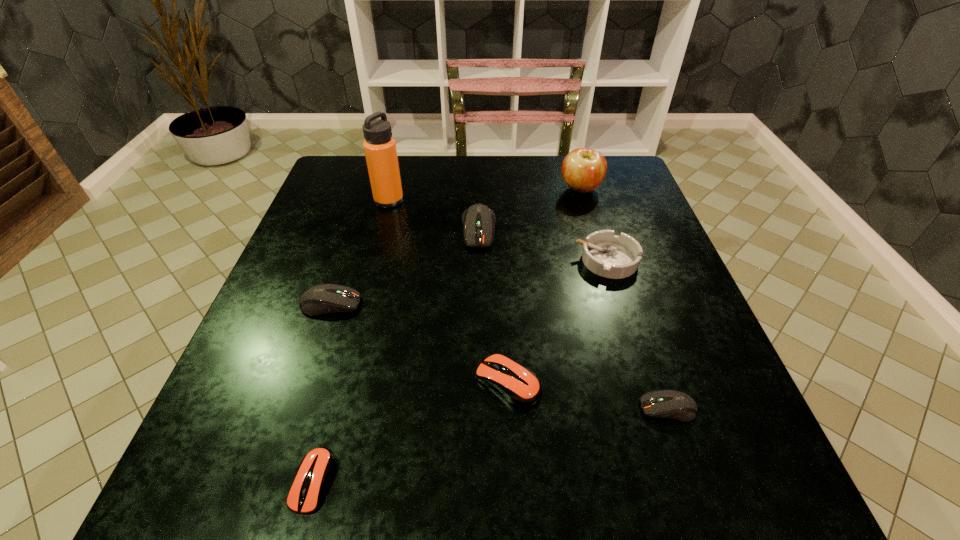
Point out which object is positioned as the third nearest to the fourth nearest computer mouse. Please provide its 2D coordinates. Your answer should be formatted as a tuple, i.e. [(x, y)], where the tuple contains the x and y coordinates of a point satisfying the conditions above.

[(315, 469)]

Locate an element on the screen. The image size is (960, 540). the sixth closest object relative to the shortest object is located at coordinates (380, 149).

You are a GUI agent. You are given a task and a screenshot of the screen. Output one action in this format:
    pyautogui.click(x=<x>, y=<y>)
    Task: Click on the computer mouse identified as the closest to the second biggest dark computer equipment
    The height and width of the screenshot is (540, 960).
    Given the screenshot: What is the action you would take?
    pyautogui.click(x=478, y=220)

Select which computer mouse appears as the fourth closest to the fourth shortest computer mouse. Please provide its 2D coordinates. Your answer should be formatted as a tuple, i.e. [(x, y)], where the tuple contains the x and y coordinates of a point satisfying the conditions above.

[(673, 404)]

Point out which dark computer equipment is positioned as the second nearest to the ashtray. Please provide its 2D coordinates. Your answer should be formatted as a tuple, i.e. [(x, y)], where the tuple contains the x and y coordinates of a point satisfying the conditions above.

[(673, 404)]

Identify which dark computer equipment is the nearest to the apple. Please provide its 2D coordinates. Your answer should be formatted as a tuple, i.e. [(x, y)], where the tuple contains the x and y coordinates of a point satisfying the conditions above.

[(478, 220)]

Identify the location of vacant region that satisfies the following two spatial constraints: 1. on the button of the farther orange computer mouse; 2. on the right side of the second dark computer equipment from left to right. (478, 382).

At what (x,y) coordinates should I click in order to perform the action: click on vacant area that satisfies the following two spatial constraints: 1. on the back side of the ashtray; 2. on the right side of the nearest object. Please return your answer as a coordinate pair (x, y). Looking at the image, I should click on (372, 260).

What are the coordinates of `free space in the image that satisfies the following two spatial constraints: 1. on the back side of the ashtray; 2. on the left side of the right orange computer mouse` in the screenshot? It's located at (501, 260).

In order to click on free space that satisfies the following two spatial constraints: 1. on the button of the tallest computer mouse; 2. on the button of the fourth nearest object in this screenshot , I will do `click(479, 304)`.